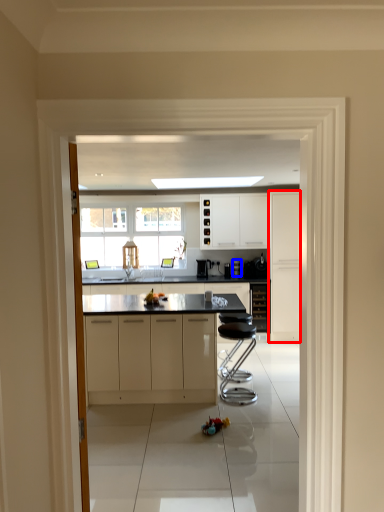
Question: Among these objects, which one is farthest to the camera, cabinetry (highlighted by a red box) or coffee machine (highlighted by a blue box)?

Choices:
 (A) cabinetry
 (B) coffee machine

Answer: (B)